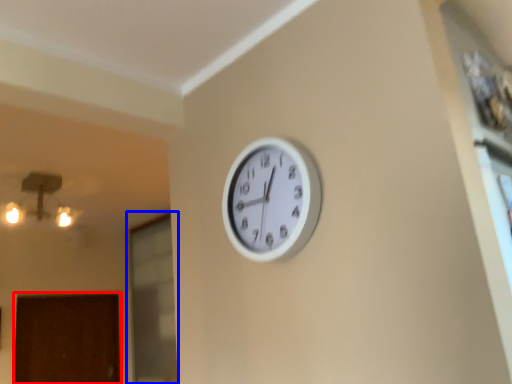
Question: Which object is closer to the camera taking this photo, door (highlighted by a red box) or glass door (highlighted by a blue box)?

Choices:
 (A) door
 (B) glass door

Answer: (B)